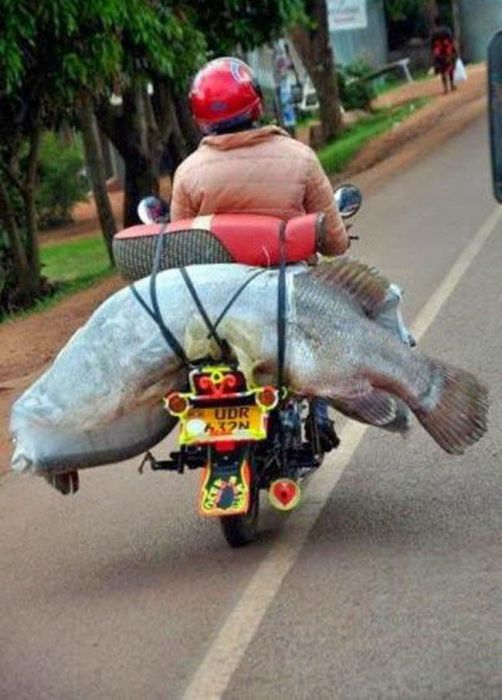
This screenshot has height=700, width=502. What are the coordinates of `mirrors` in the screenshot? It's located at (350, 197), (153, 204).